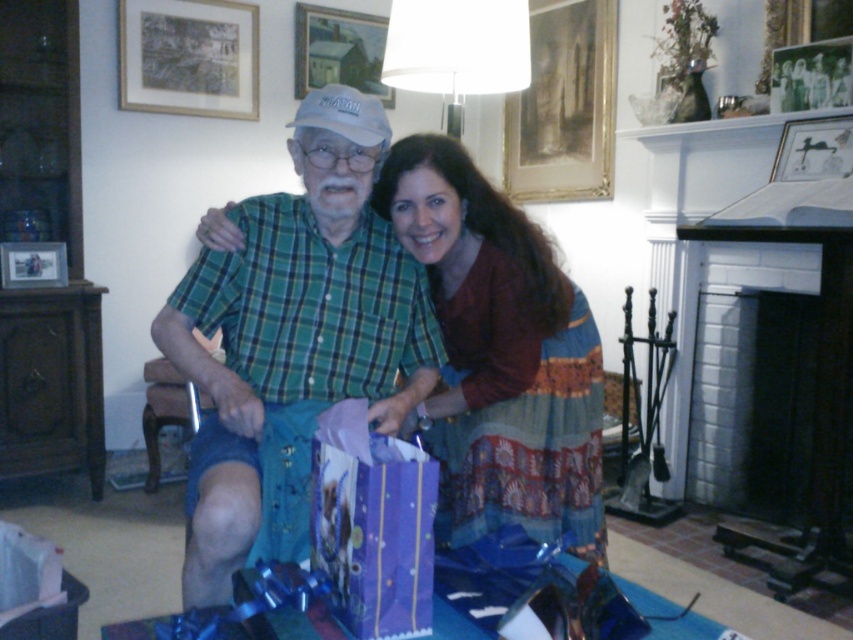
Question: Is maroon fabric dress at center bigger than purple paper gift at center?

Choices:
 (A) no
 (B) yes

Answer: (B)

Question: Is the position of matte black picture frame at upper right less distant than that of wooden picture frame at upper left?

Choices:
 (A) yes
 (B) no

Answer: (A)

Question: Which point is farther to the camera?

Choices:
 (A) matte wooden picture frame at upper center
 (B) gold-framed painting at upper center
 (C) purple paper gift at center

Answer: (A)

Question: Which point is farther to the camera?

Choices:
 (A) (36, 266)
 (B) (440, 305)
 (C) (817, 141)

Answer: (A)

Question: Can you confirm if green plaid shirt at center is thinner than purple paper gift at center?

Choices:
 (A) no
 (B) yes

Answer: (A)

Question: Which object is positioned closest to the matte paper picture frame at upper left?

Choices:
 (A) matte wooden picture frame at upper center
 (B) green plaid shirt at center
 (C) purple paper gift at center

Answer: (A)